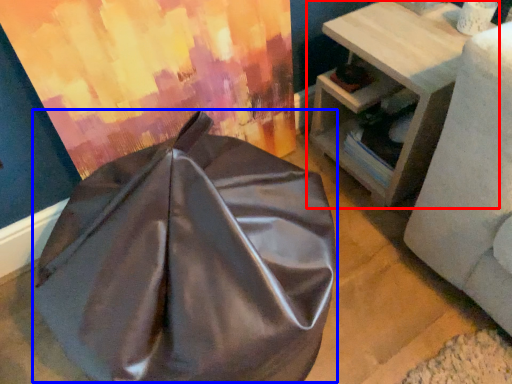
Question: Which object is further to the camera taking this photo, table (highlighted by a red box) or bean bag chair (highlighted by a blue box)?

Choices:
 (A) table
 (B) bean bag chair

Answer: (A)